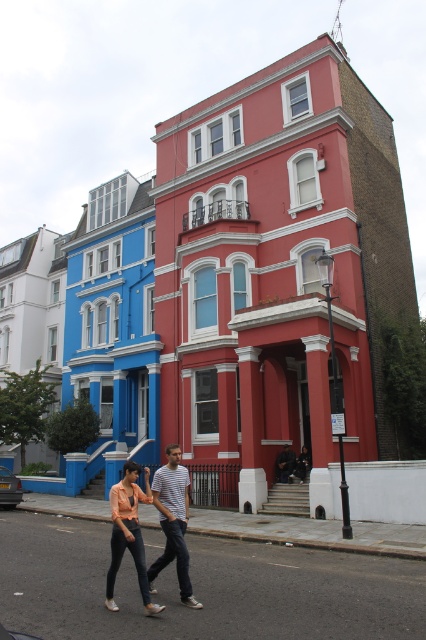
You are a photographer standing on the sidewalk in front of the two houses. You see a striped cotton shirt at center and a matte peach blouse at center. Which clothing item is positioned more to the right?

The striped cotton shirt at center is positioned to the right of the matte peach blouse at center, so the striped cotton shirt at center is more to the right.

You are a fashion designer observing the street scene. You notice two people wearing the striped cotton shirt at center and the matte peach blouse at center. Which clothing item reaches lower on the body?

The matte peach blouse at center reaches lower on the body since it is taller than the striped cotton shirt at center.